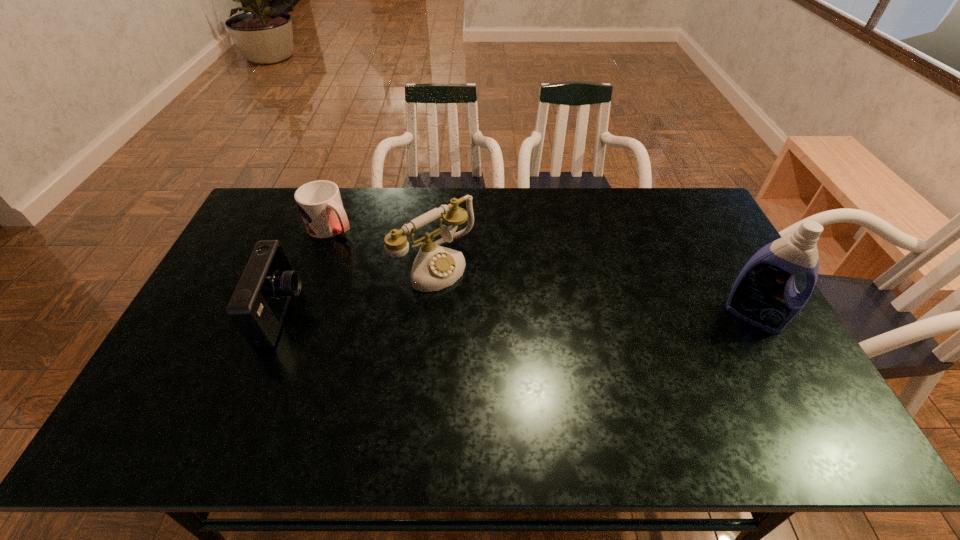
This screenshot has width=960, height=540. In order to click on free spot on the desktop that is between the camera and the rightmost object and is positioned on the dial of the telephone in this screenshot , I will do `click(495, 314)`.

Identify the location of vacant space on the desktop that is between the third tallest object and the rightmost object and is positioned on the side of the mug with the handle. (464, 314).